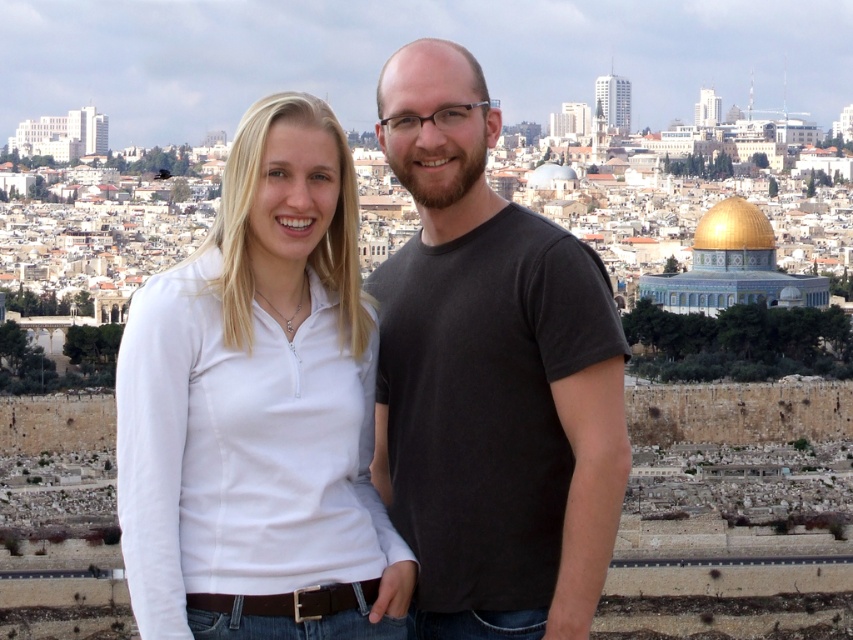
You are a photographer trying to capture the golden dome in the background. You notice the white matte shirt at center might be blocking your view. Based on its position at point 0.641, 0.305, can you estimate if adjusting your camera angle slightly to the left would help frame the dome better?

The white matte shirt at center is located at point [259,410], so adjusting the camera angle slightly to the left might help frame the golden dome better by moving the shirt out of the way.